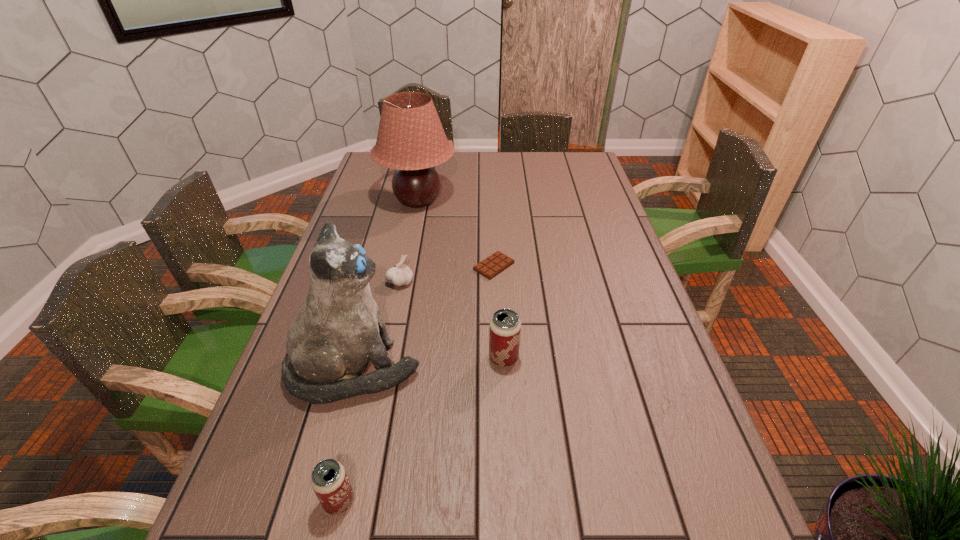
Find the location of a particular element. The width and height of the screenshot is (960, 540). vacant space located on the back of the garlic is located at coordinates click(407, 251).

The height and width of the screenshot is (540, 960). In order to click on free space located 0.130m on the front-facing side of the farthest object in this screenshot , I will do pyautogui.click(x=492, y=201).

Where is `vacant point located 0.380m at the face of the cat`? The height and width of the screenshot is (540, 960). vacant point located 0.380m at the face of the cat is located at coordinates (582, 369).

The height and width of the screenshot is (540, 960). I want to click on vacant area located on the right of the shortest object, so click(575, 267).

Identify the location of object that is at the near edge. This screenshot has height=540, width=960. (329, 480).

Where is `lampshade at the left edge`? The width and height of the screenshot is (960, 540). lampshade at the left edge is located at coordinates (411, 139).

Find the location of a particular element. The width and height of the screenshot is (960, 540). cat situated at the left edge is located at coordinates (340, 328).

You are a GUI agent. You are given a task and a screenshot of the screen. Output one action in this format:
    pyautogui.click(x=<x>, y=<y>)
    Task: Click on the free space at the far edge of the desktop
    This screenshot has height=540, width=960.
    Given the screenshot: What is the action you would take?
    pyautogui.click(x=478, y=160)

The width and height of the screenshot is (960, 540). In order to click on free location at the left edge in this screenshot , I will do `click(361, 224)`.

In the image, there is a desktop. Where is `free space at the right edge`? free space at the right edge is located at coordinates (585, 205).